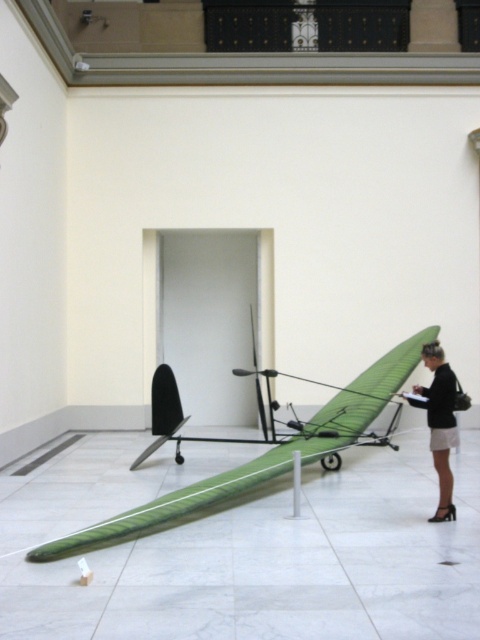
Question: Which point appears farthest from the camera in this image?

Choices:
 (A) (419, 355)
 (B) (447, 465)

Answer: (A)

Question: Does green fabric plane at center appear on the right side of black leather skirt at lower right?

Choices:
 (A) yes
 (B) no

Answer: (B)

Question: Among these points, which one is farthest from the camera?

Choices:
 (A) (317, 445)
 (B) (432, 352)

Answer: (A)

Question: Can you confirm if green fabric plane at center is wider than black leather skirt at lower right?

Choices:
 (A) yes
 (B) no

Answer: (B)

Question: Can you confirm if green fabric plane at center is bigger than black leather skirt at lower right?

Choices:
 (A) yes
 (B) no

Answer: (B)